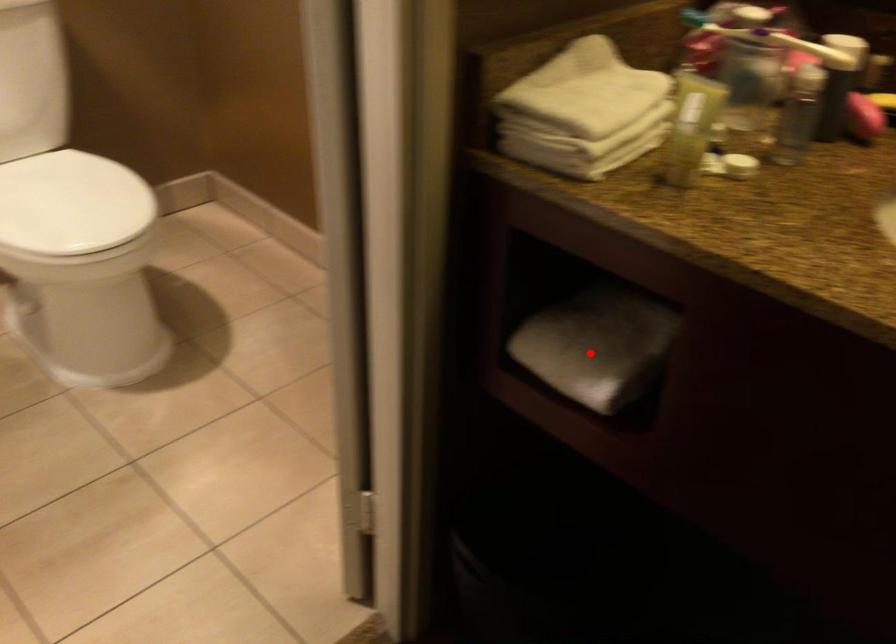
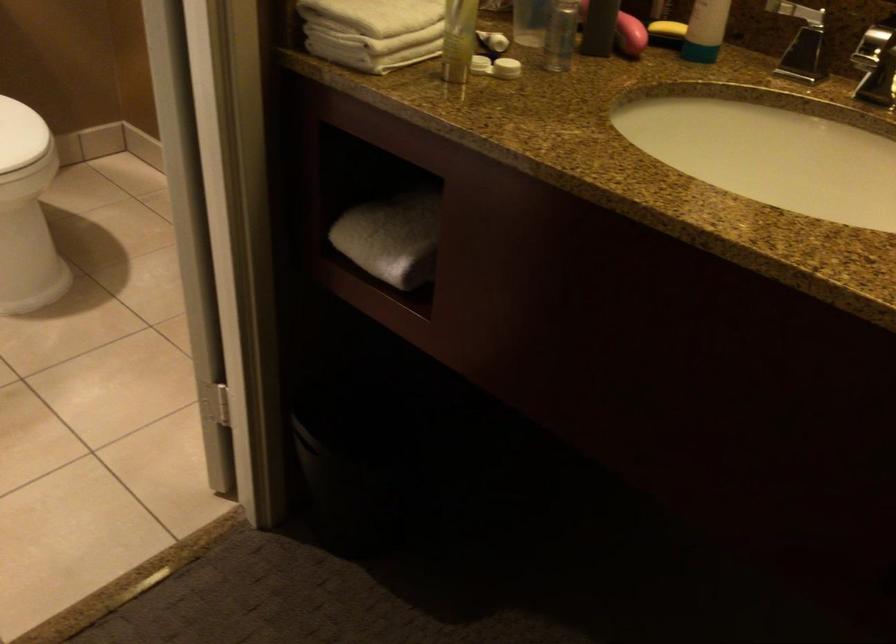
Question: I am providing you with two images of the same scene from different viewpoints. In image1, a red point is highlighted. Considering the same 3D point in image2, which of the following is correct?

Choices:
 (A) It is closer
 (B) It is farther

Answer: (B)